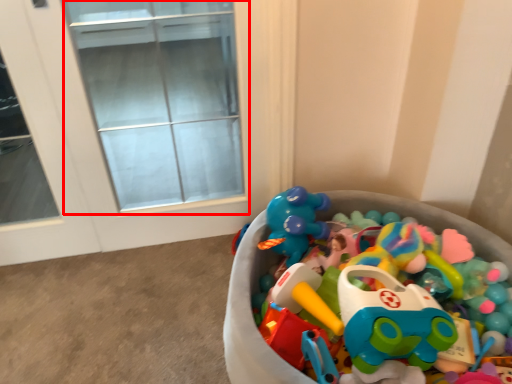
Question: From the image's perspective, what is the correct spatial relationship of glass door (annotated by the red box) in relation to toy?

Choices:
 (A) below
 (B) above

Answer: (B)